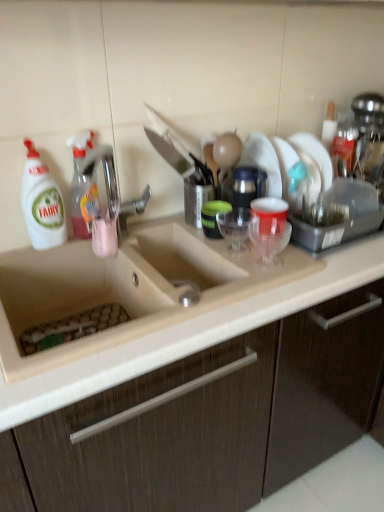
Find the location of a particular element. This screenshot has height=512, width=384. free space to the left of translucent plastic cup at sink, positioned as the first tableware in left-to-right order is located at coordinates (163, 223).